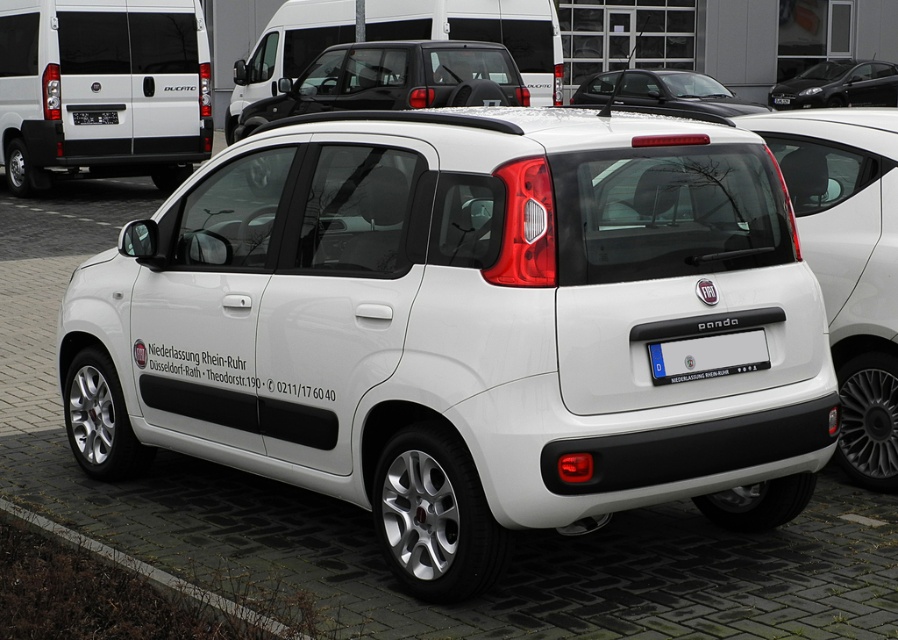
What do you see at coordinates (707, 356) in the screenshot? The height and width of the screenshot is (640, 898). I see `blue metallic license plate at center` at bounding box center [707, 356].

Between blue metallic license plate at center and gray concrete curb at lower left, which one appears on the right side from the viewer's perspective?

blue metallic license plate at center

Is point (658, 358) less distant than point (11, 508)?

Yes, point (658, 358) is in front of point (11, 508).

Locate an element on the screen. The height and width of the screenshot is (640, 898). blue metallic license plate at center is located at coordinates (707, 356).

Who is higher up, gray concrete curb at lower left or blue plastic license plate at rear?

blue plastic license plate at rear is above.

Can you confirm if gray concrete curb at lower left is thinner than blue plastic license plate at rear?

Incorrect, gray concrete curb at lower left's width is not less than blue plastic license plate at rear's.

Which is in front, point (232, 604) or point (101, 120)?

Point (232, 604) is more forward.

I want to click on gray concrete curb at lower left, so click(x=154, y=572).

Is white matte minivan at center further to the viewer compared to blue plastic license plate at rear?

No, white matte minivan at center is closer to the viewer.

Between point (371, 60) and point (81, 115), which one is positioned in front?

Positioned in front is point (81, 115).

Is point (329, 90) behind point (78, 120)?

Yes, it is behind point (78, 120).

At what (x,y) coordinates should I click in order to perform the action: click on white matte minivan at center. Please return your answer as a coordinate pair (x, y). Looking at the image, I should click on (393, 81).